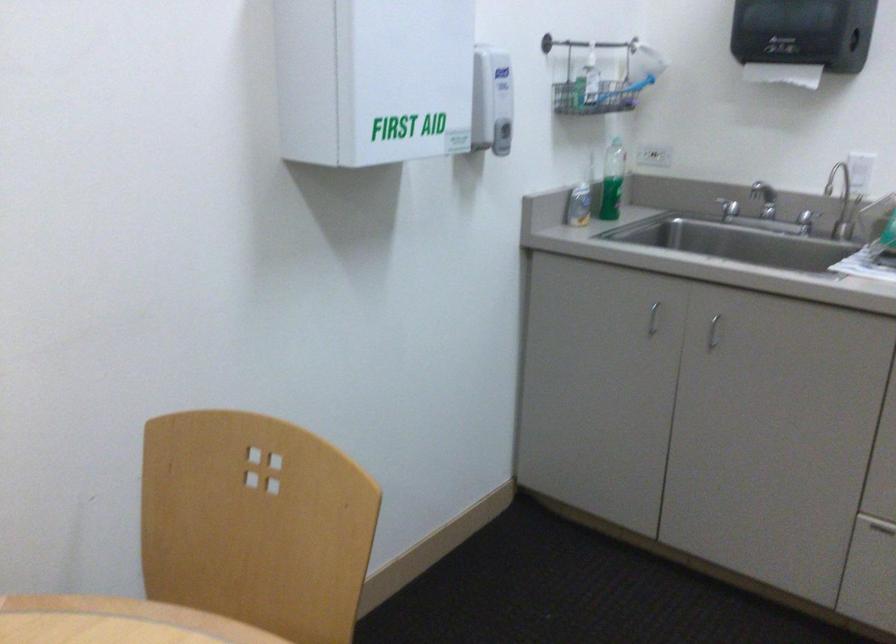
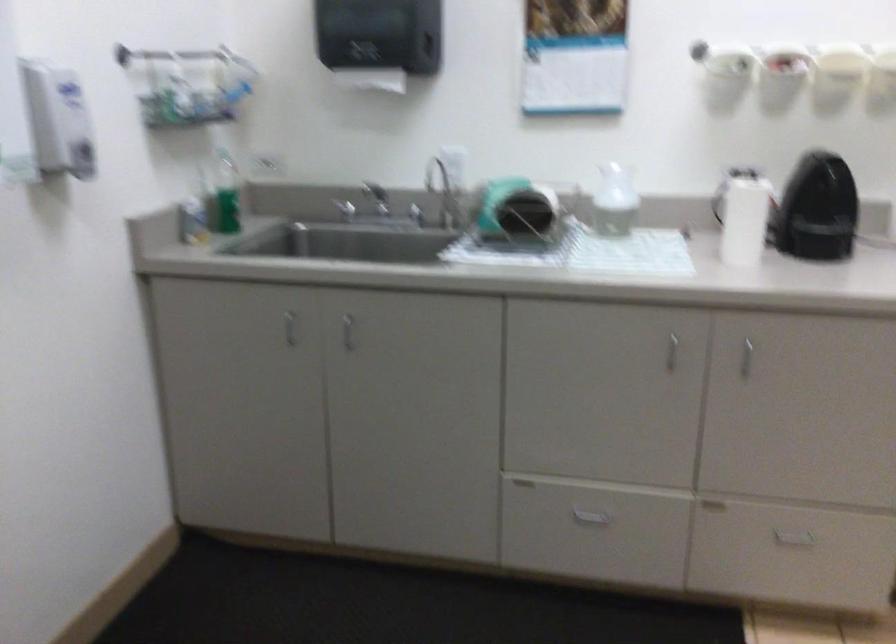
Question: The images are taken continuously from a first-person perspective. In which direction are you moving?

Choices:
 (A) Left
 (B) Right
 (C) Forward
 (D) Backward

Answer: (B)